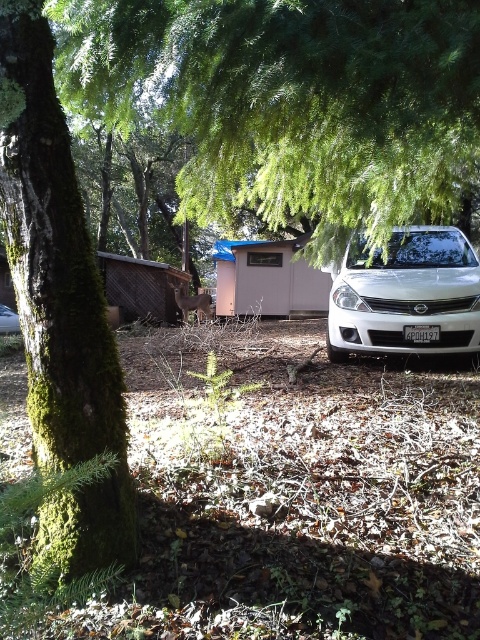
You are a delivery person trying to park your white matte sedan at center in a spot near the green mossy tree at left. The parking spot requires a minimum clearance of 30 inches between the car and any obstacles. Can you safely park there?

The distance between the green mossy tree at left and the white matte sedan at center is 32.39 inches, which exceeds the required 30 inches clearance. Therefore, you can safely park the white matte sedan at center near the green mossy tree at left.

You are standing at the point marked as point (407,296) in the image. What object is located at that point?

The point (407,296) corresponds to the white matte sedan at center.